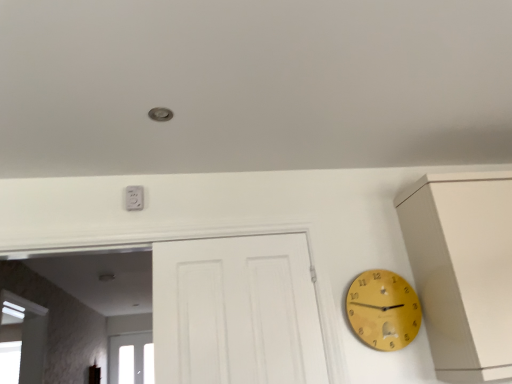
Question: From a real-world perspective, is white plastic outlet at upper center positioned under yellow wooden clock at right based on gravity?

Choices:
 (A) no
 (B) yes

Answer: (A)

Question: Is white plastic outlet at upper center at the left side of yellow wooden clock at right?

Choices:
 (A) yes
 (B) no

Answer: (A)

Question: Is white plastic outlet at upper center wider than yellow wooden clock at right?

Choices:
 (A) no
 (B) yes

Answer: (A)

Question: From the image's perspective, would you say white plastic outlet at upper center is shown under yellow wooden clock at right?

Choices:
 (A) no
 (B) yes

Answer: (A)

Question: From the image's perspective, is white plastic outlet at upper center on top of yellow wooden clock at right?

Choices:
 (A) yes
 (B) no

Answer: (A)

Question: From a real-world perspective, does white plastic outlet at upper center stand above yellow wooden clock at right?

Choices:
 (A) no
 (B) yes

Answer: (B)

Question: From a real-world perspective, is yellow wooden clock at right physically below white plastic outlet at upper center?

Choices:
 (A) yes
 (B) no

Answer: (A)

Question: Is yellow wooden clock at right looking in the opposite direction of white plastic outlet at upper center?

Choices:
 (A) no
 (B) yes

Answer: (A)

Question: Could you tell me if yellow wooden clock at right is facing white plastic outlet at upper center?

Choices:
 (A) yes
 (B) no

Answer: (B)

Question: From a real-world perspective, is yellow wooden clock at right on top of white plastic outlet at upper center?

Choices:
 (A) yes
 (B) no

Answer: (B)

Question: Is yellow wooden clock at right wider than white plastic outlet at upper center?

Choices:
 (A) yes
 (B) no

Answer: (A)

Question: Considering the relative positions of yellow wooden clock at right and white plastic outlet at upper center in the image provided, is yellow wooden clock at right to the left of white plastic outlet at upper center from the viewer's perspective?

Choices:
 (A) yes
 (B) no

Answer: (B)

Question: Is transparent glass window at lower left oriented away from white plastic outlet at upper center?

Choices:
 (A) no
 (B) yes

Answer: (A)